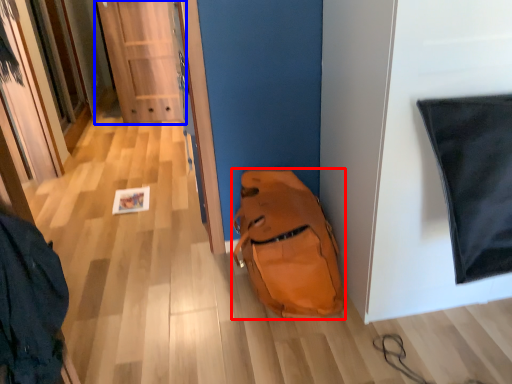
Question: Which point is further to the camera, backpack (highlighted by a red box) or door (highlighted by a blue box)?

Choices:
 (A) backpack
 (B) door

Answer: (B)